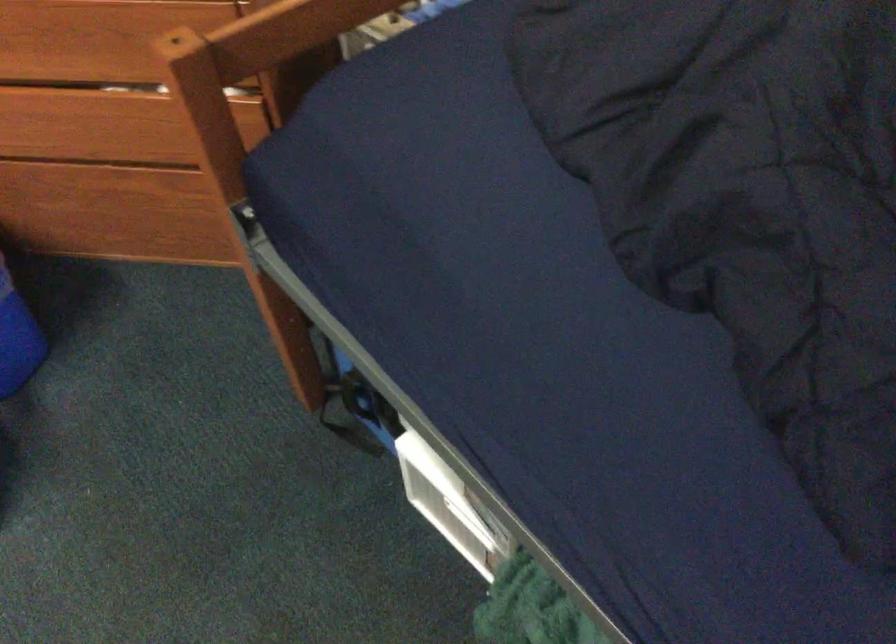
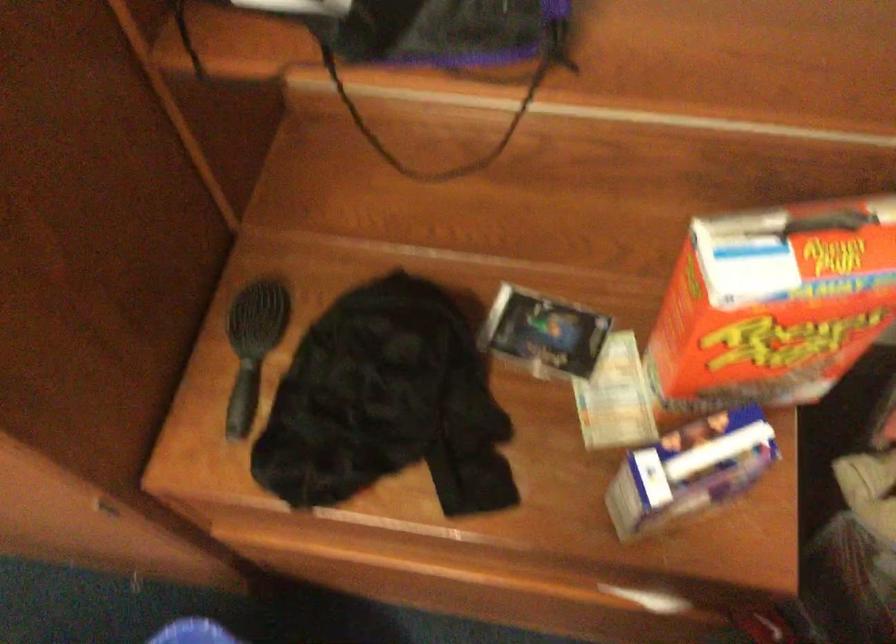
Which direction would the cameraman need to move to produce the second image?

The cameraman moved toward left, forward.